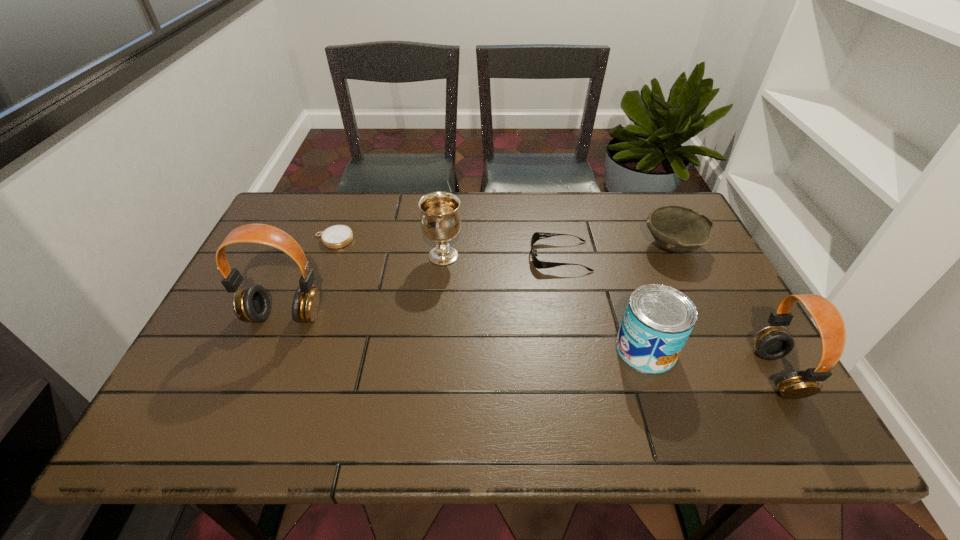
The height and width of the screenshot is (540, 960). Identify the location of location for an additional headset to make spacing equal. (516, 343).